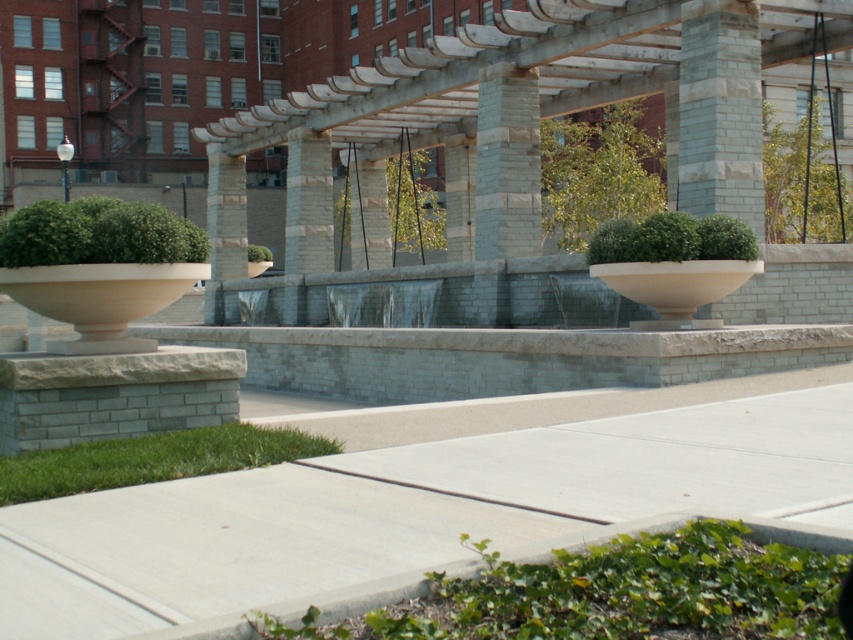
Between concrete at center and gray stone pillar at center, which one is positioned higher?

gray stone pillar at center is above.

Can you confirm if concrete at center is positioned below gray stone pillar at center?

Correct, concrete at center is located below gray stone pillar at center.

Is point (527, 420) less distant than point (294, 134)?

Yes, point (527, 420) is in front of point (294, 134).

This screenshot has height=640, width=853. Find the location of `concrete at center`. concrete at center is located at coordinates (424, 502).

Is gray stone column at center taller than slate gray stone pillar at center?

No, gray stone column at center is not taller than slate gray stone pillar at center.

Between gray stone column at center and slate gray stone pillar at center, which one has more height?

With more height is slate gray stone pillar at center.

Find the location of a particular element. This screenshot has width=853, height=640. gray stone column at center is located at coordinates (508, 163).

Identify the location of gray stone column at center. The image size is (853, 640). (508, 163).

Between gray stone pillar at center and slate gray stone pillar at center, which one has more height?

slate gray stone pillar at center is taller.

Is gray stone pillar at center closer to the viewer compared to slate gray stone pillar at center?

Yes, gray stone pillar at center is closer to the viewer.

Measure the distance between gray stone pillar at center and camera.

gray stone pillar at center is 25.98 meters away from camera.

You are a GUI agent. You are given a task and a screenshot of the screen. Output one action in this format:
    pyautogui.click(x=<x>, y=<y>)
    Task: Click on the gray stone pillar at center
    This screenshot has width=853, height=640.
    Given the screenshot: What is the action you would take?
    pyautogui.click(x=308, y=202)